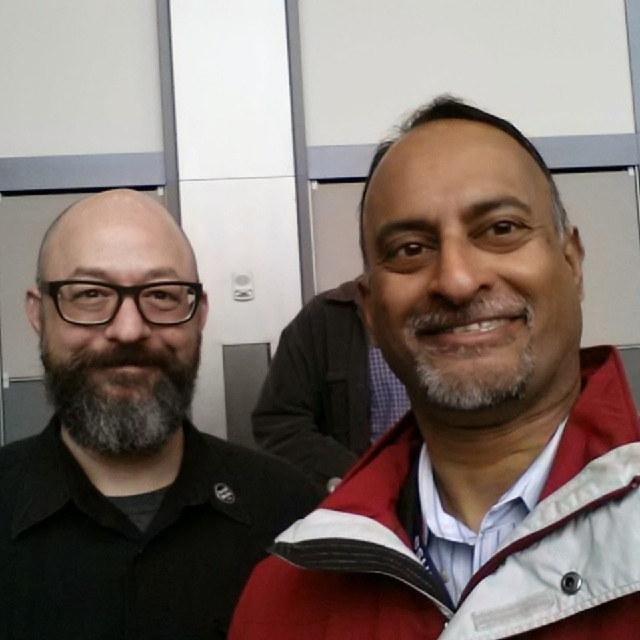
You are standing in the room and want to determine which of the two points, point [566,547] or point [163,381], is nearer to you. Based on the scene description, which point is closer?

Point [566,547] is closer to the viewer than point [163,381].

You are an interior designer assessing the spatial arrangement of the room. You need to place a decorative shelf between the red fleece jacket at center and the gray matte beard at left. Based on their relative widths, which object should the shelf be placed closer to?

The red fleece jacket at center is wider than the gray matte beard at left, so the shelf should be placed closer to the red fleece jacket at center to account for its larger width.

You are standing in the room and want to touch the red fleece jacket at center. Which direction should you move relative to the point marked by the coordinates point (486, 561)?

The red fleece jacket at center is represented by point (486, 561), so you should move towards that point to touch it.